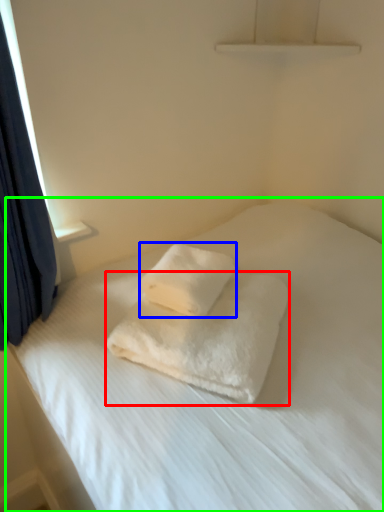
Question: Which object is the closest to the towel (highlighted by a red box)? Choose among these: towel (highlighted by a blue box) or bed (highlighted by a green box).

Choices:
 (A) towel
 (B) bed

Answer: (A)